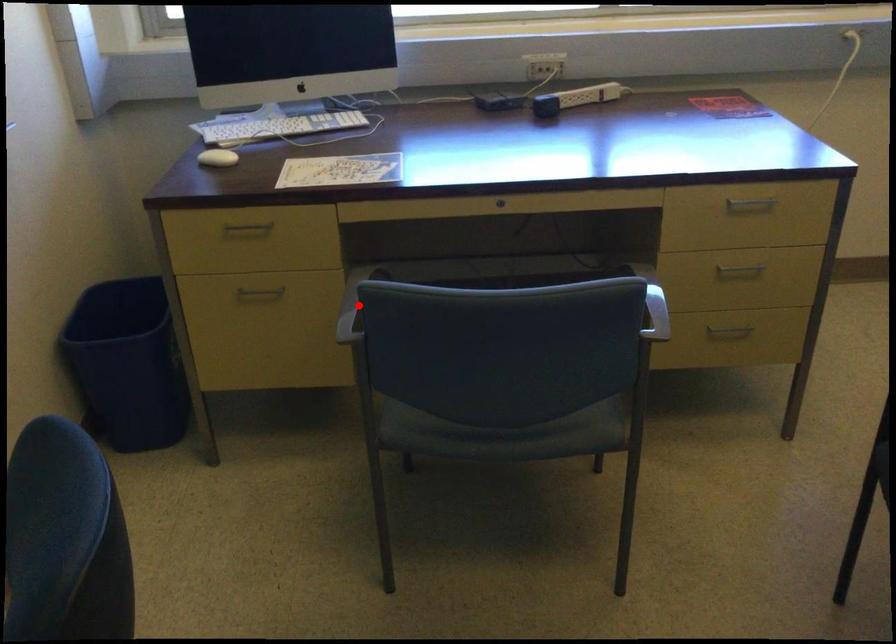
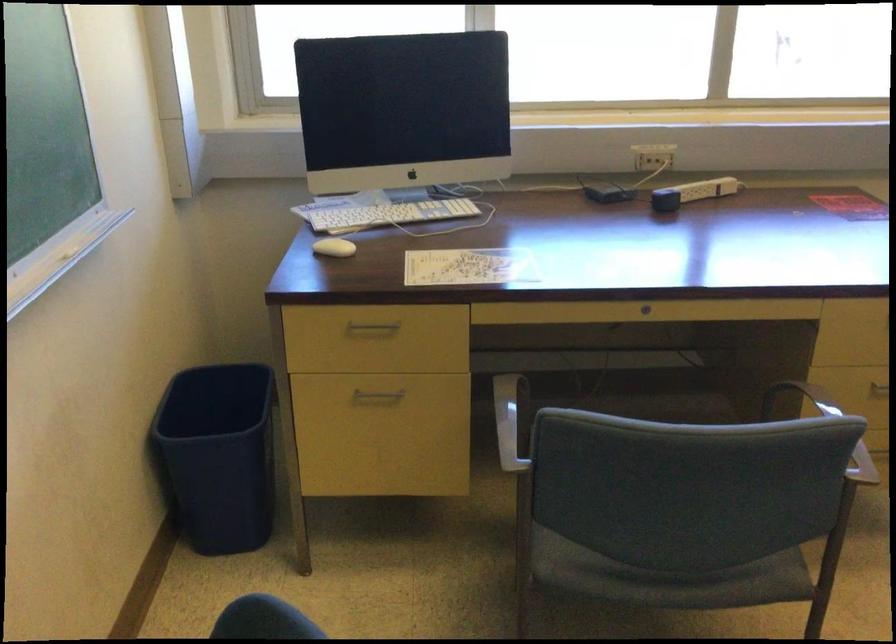
Where in the second image is the point corresponding to the highlighted location from the first image?

(511, 421)